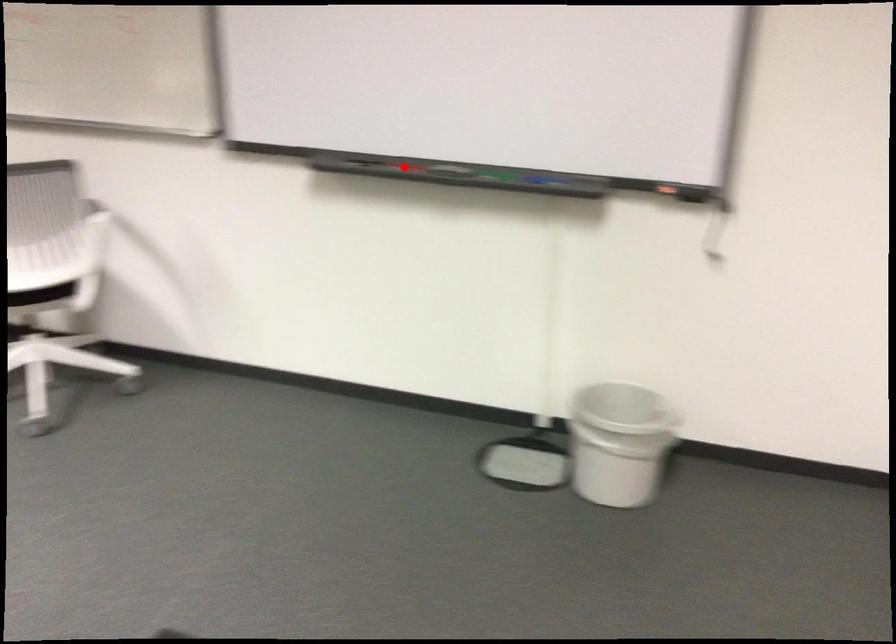
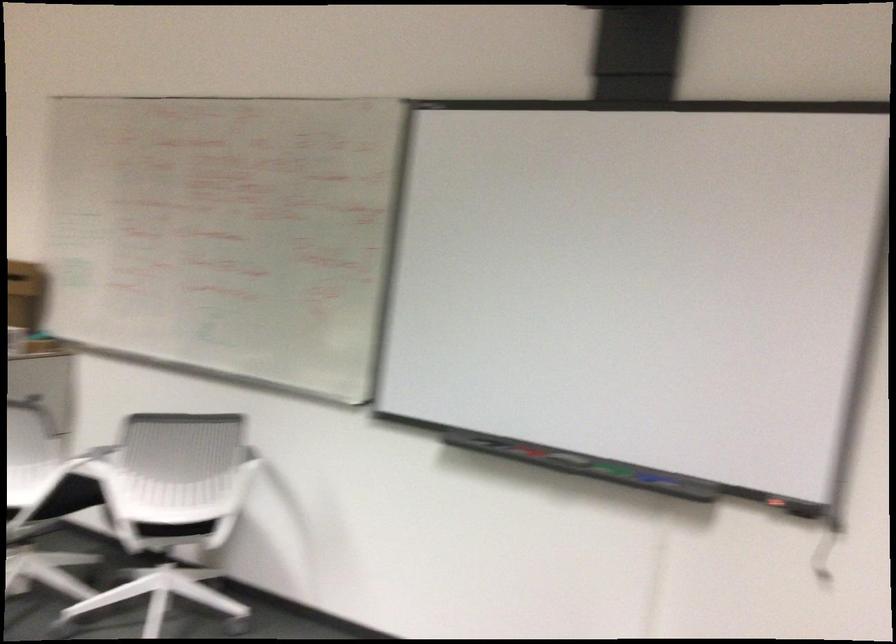
Question: I am providing you with two images of the same scene from different viewpoints. A red point is marked on the first image. At the location where the point appears in image 1, is it still visible in image 2?

Choices:
 (A) Yes
 (B) No

Answer: (A)